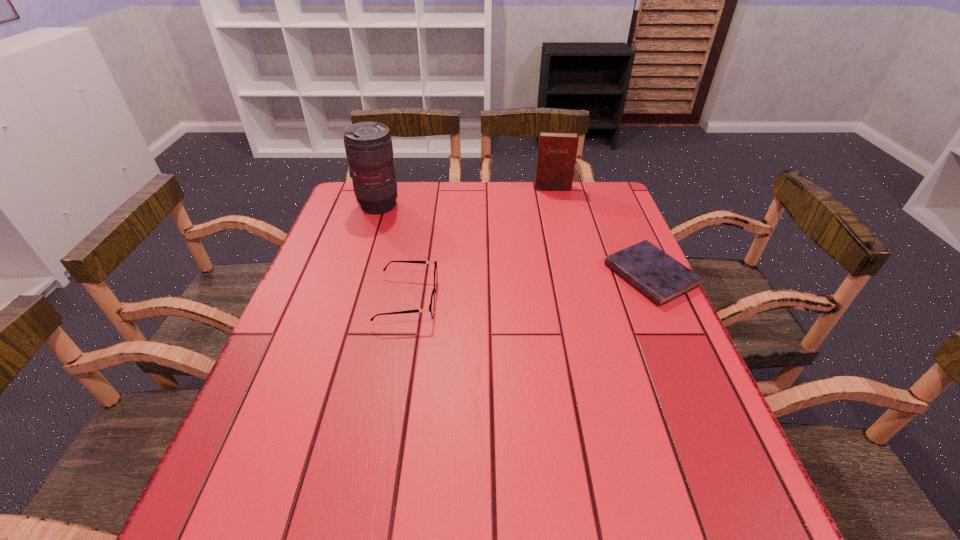
Image resolution: width=960 pixels, height=540 pixels. I want to click on spectacles, so click(x=432, y=303).

At what (x,y) coordinates should I click in order to perform the action: click on the third tallest object. Please return your answer as a coordinate pair (x, y). This screenshot has height=540, width=960. Looking at the image, I should click on (432, 303).

Where is `the shortest object`? The width and height of the screenshot is (960, 540). the shortest object is located at coordinates (658, 276).

What are the coordinates of `the right diary` in the screenshot? It's located at (658, 276).

You are a GUI agent. You are given a task and a screenshot of the screen. Output one action in this format:
    pyautogui.click(x=<x>, y=<y>)
    Task: Click on the farther diary
    Image resolution: width=960 pixels, height=540 pixels.
    Given the screenshot: What is the action you would take?
    pyautogui.click(x=557, y=151)

This screenshot has height=540, width=960. What are the coordinates of `the farthest object` in the screenshot? It's located at (557, 151).

Identify the location of the tallest object. The image size is (960, 540). (368, 145).

Find the location of a particular element. The height and width of the screenshot is (540, 960). the second farthest object is located at coordinates (368, 145).

Find the location of a particular element. The width and height of the screenshot is (960, 540). vacant space located 0.360m on the front-facing side of the spectacles is located at coordinates (583, 300).

The image size is (960, 540). In order to click on free space located on the left of the right diary in this screenshot , I will do `click(527, 276)`.